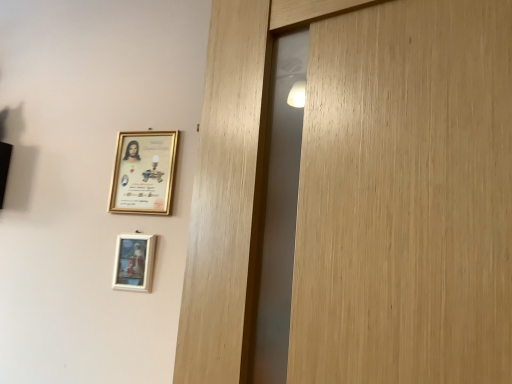
This screenshot has height=384, width=512. What do you see at coordinates (143, 172) in the screenshot?
I see `gold-framed picture at upper left, the second picture frame when ordered from bottom to top` at bounding box center [143, 172].

Measure the distance between gold-framed picture at upper left, the second picture frame when ordered from bottom to top, and camera.

gold-framed picture at upper left, the second picture frame when ordered from bottom to top, and camera are 4.31 feet apart.

You are a GUI agent. You are given a task and a screenshot of the screen. Output one action in this format:
    pyautogui.click(x=<x>, y=<y>)
    Task: Click on the gold-framed picture at upper left, the second picture frame when ordered from bottom to top
    
    Given the screenshot: What is the action you would take?
    pyautogui.click(x=143, y=172)

Describe the element at coordinates (134, 262) in the screenshot. The image size is (512, 384). I see `white matte picture frame at lower center, which appears as the second picture frame when viewed from the top` at that location.

Find the location of a particular element. The image size is (512, 384). white matte picture frame at lower center, placed as the 1th picture frame when sorted from bottom to top is located at coordinates (134, 262).

Measure the distance between white matte picture frame at lower center, which appears as the second picture frame when viewed from the top, and camera.

white matte picture frame at lower center, which appears as the second picture frame when viewed from the top, and camera are 4.20 feet apart.

This screenshot has width=512, height=384. Find the location of `gold-framed picture at upper left, the second picture frame when ordered from bottom to top`. gold-framed picture at upper left, the second picture frame when ordered from bottom to top is located at coordinates (143, 172).

Considering the positions of objects white matte picture frame at lower center, which appears as the second picture frame when viewed from the top, and gold-framed picture at upper left, which is the 1th picture frame from top to bottom, in the image provided, who is more to the right, white matte picture frame at lower center, which appears as the second picture frame when viewed from the top, or gold-framed picture at upper left, which is the 1th picture frame from top to bottom,?

gold-framed picture at upper left, which is the 1th picture frame from top to bottom, is more to the right.

Does white matte picture frame at lower center, which appears as the second picture frame when viewed from the top, lie in front of gold-framed picture at upper left, which is the 1th picture frame from top to bottom?

Yes, the depth of white matte picture frame at lower center, which appears as the second picture frame when viewed from the top, is less than that of gold-framed picture at upper left, which is the 1th picture frame from top to bottom.

Which point is more distant from viewer, (118, 250) or (148, 193)?

Point (148, 193)

From the image's perspective, is white matte picture frame at lower center, placed as the 1th picture frame when sorted from bottom to top, below gold-framed picture at upper left, which is the 1th picture frame from top to bottom?

Yes, from the image's perspective, white matte picture frame at lower center, placed as the 1th picture frame when sorted from bottom to top, is beneath gold-framed picture at upper left, which is the 1th picture frame from top to bottom.

From a real-world perspective, is white matte picture frame at lower center, which appears as the second picture frame when viewed from the top, physically below gold-framed picture at upper left, the second picture frame when ordered from bottom to top?

Indeed, from a real-world perspective, white matte picture frame at lower center, which appears as the second picture frame when viewed from the top, is positioned beneath gold-framed picture at upper left, the second picture frame when ordered from bottom to top.

Is white matte picture frame at lower center, which appears as the second picture frame when viewed from the top, wider than gold-framed picture at upper left, which is the 1th picture frame from top to bottom?

No, white matte picture frame at lower center, which appears as the second picture frame when viewed from the top, is not wider than gold-framed picture at upper left, which is the 1th picture frame from top to bottom.

Is white matte picture frame at lower center, placed as the 1th picture frame when sorted from bottom to top, taller or shorter than gold-framed picture at upper left, the second picture frame when ordered from bottom to top?

white matte picture frame at lower center, placed as the 1th picture frame when sorted from bottom to top, is shorter than gold-framed picture at upper left, the second picture frame when ordered from bottom to top.

In the scene shown: Which of these two, white matte picture frame at lower center, which appears as the second picture frame when viewed from the top, or gold-framed picture at upper left, the second picture frame when ordered from bottom to top, is bigger?

gold-framed picture at upper left, the second picture frame when ordered from bottom to top.

Is white matte picture frame at lower center, which appears as the second picture frame when viewed from the top, inside the boundaries of gold-framed picture at upper left, the second picture frame when ordered from bottom to top, or outside?

white matte picture frame at lower center, which appears as the second picture frame when viewed from the top, cannot be found inside gold-framed picture at upper left, the second picture frame when ordered from bottom to top.

Is white matte picture frame at lower center, placed as the 1th picture frame when sorted from bottom to top, positioned far away from gold-framed picture at upper left, the second picture frame when ordered from bottom to top?

No, white matte picture frame at lower center, placed as the 1th picture frame when sorted from bottom to top, is not far away from gold-framed picture at upper left, the second picture frame when ordered from bottom to top.

Could you tell me if white matte picture frame at lower center, which appears as the second picture frame when viewed from the top, is turned towards gold-framed picture at upper left, which is the 1th picture frame from top to bottom?

No, white matte picture frame at lower center, which appears as the second picture frame when viewed from the top, does not turn towards gold-framed picture at upper left, which is the 1th picture frame from top to bottom.

Find the location of a particular element. This screenshot has height=384, width=512. picture frame that appears behind the white matte picture frame at lower center, which appears as the second picture frame when viewed from the top is located at coordinates (143, 172).

Visually, is gold-framed picture at upper left, the second picture frame when ordered from bottom to top, positioned to the left or to the right of white matte picture frame at lower center, placed as the 1th picture frame when sorted from bottom to top?

Based on their positions, gold-framed picture at upper left, the second picture frame when ordered from bottom to top, is located to the right of white matte picture frame at lower center, placed as the 1th picture frame when sorted from bottom to top.

Does gold-framed picture at upper left, the second picture frame when ordered from bottom to top, lie in front of white matte picture frame at lower center, which appears as the second picture frame when viewed from the top?

No.

Is point (120, 158) more distant than point (151, 275)?

Yes, point (120, 158) is farther from viewer.

From the image's perspective, is gold-framed picture at upper left, which is the 1th picture frame from top to bottom, under white matte picture frame at lower center, which appears as the second picture frame when viewed from the top?

Answer: Actually, gold-framed picture at upper left, which is the 1th picture frame from top to bottom, appears above white matte picture frame at lower center, which appears as the second picture frame when viewed from the top, in the image.

From a real-world perspective, between gold-framed picture at upper left, which is the 1th picture frame from top to bottom, and white matte picture frame at lower center, placed as the 1th picture frame when sorted from bottom to top, who is vertically higher?

From a 3D spatial view, gold-framed picture at upper left, which is the 1th picture frame from top to bottom, is above.

Does gold-framed picture at upper left, which is the 1th picture frame from top to bottom, have a greater width compared to white matte picture frame at lower center, placed as the 1th picture frame when sorted from bottom to top?

Correct, the width of gold-framed picture at upper left, which is the 1th picture frame from top to bottom, exceeds that of white matte picture frame at lower center, placed as the 1th picture frame when sorted from bottom to top.

Between gold-framed picture at upper left, the second picture frame when ordered from bottom to top, and white matte picture frame at lower center, placed as the 1th picture frame when sorted from bottom to top, which one has more height?

Standing taller between the two is gold-framed picture at upper left, the second picture frame when ordered from bottom to top.

Between gold-framed picture at upper left, which is the 1th picture frame from top to bottom, and white matte picture frame at lower center, which appears as the second picture frame when viewed from the top, which one has larger size?

gold-framed picture at upper left, which is the 1th picture frame from top to bottom, is bigger.

Is white matte picture frame at lower center, which appears as the second picture frame when viewed from the top, located within gold-framed picture at upper left, which is the 1th picture frame from top to bottom?

Actually, white matte picture frame at lower center, which appears as the second picture frame when viewed from the top, is outside gold-framed picture at upper left, which is the 1th picture frame from top to bottom.

Is gold-framed picture at upper left, which is the 1th picture frame from top to bottom, placed right next to white matte picture frame at lower center, which appears as the second picture frame when viewed from the top?

gold-framed picture at upper left, which is the 1th picture frame from top to bottom, and white matte picture frame at lower center, which appears as the second picture frame when viewed from the top, are not in contact.

Is gold-framed picture at upper left, which is the 1th picture frame from top to bottom, turned away from white matte picture frame at lower center, placed as the 1th picture frame when sorted from bottom to top?

That's not correct — gold-framed picture at upper left, which is the 1th picture frame from top to bottom, is not looking away from white matte picture frame at lower center, placed as the 1th picture frame when sorted from bottom to top.

How many degrees apart are the facing directions of gold-framed picture at upper left, the second picture frame when ordered from bottom to top, and white matte picture frame at lower center, which appears as the second picture frame when viewed from the top?

The angle between the facing direction of gold-framed picture at upper left, the second picture frame when ordered from bottom to top, and the facing direction of white matte picture frame at lower center, which appears as the second picture frame when viewed from the top, is 0.00151 degrees.

Measure the distance between gold-framed picture at upper left, the second picture frame when ordered from bottom to top, and white matte picture frame at lower center, placed as the 1th picture frame when sorted from bottom to top.

7.58 inches.

There is a white matte picture frame at lower center, placed as the 1th picture frame when sorted from bottom to top. What are the coordinates of `picture frame above it (from a real-world perspective)` in the screenshot? It's located at (143, 172).

You are a GUI agent. You are given a task and a screenshot of the screen. Output one action in this format:
    pyautogui.click(x=<x>, y=<y>)
    Task: Click on the picture frame above the white matte picture frame at lower center, placed as the 1th picture frame when sorted from bottom to top (from the image's perspective)
    
    Given the screenshot: What is the action you would take?
    pyautogui.click(x=143, y=172)

At what (x,y) coordinates should I click in order to perform the action: click on picture frame that is above the white matte picture frame at lower center, which appears as the second picture frame when viewed from the top (from a real-world perspective). Please return your answer as a coordinate pair (x, y). This screenshot has width=512, height=384. Looking at the image, I should click on [x=143, y=172].